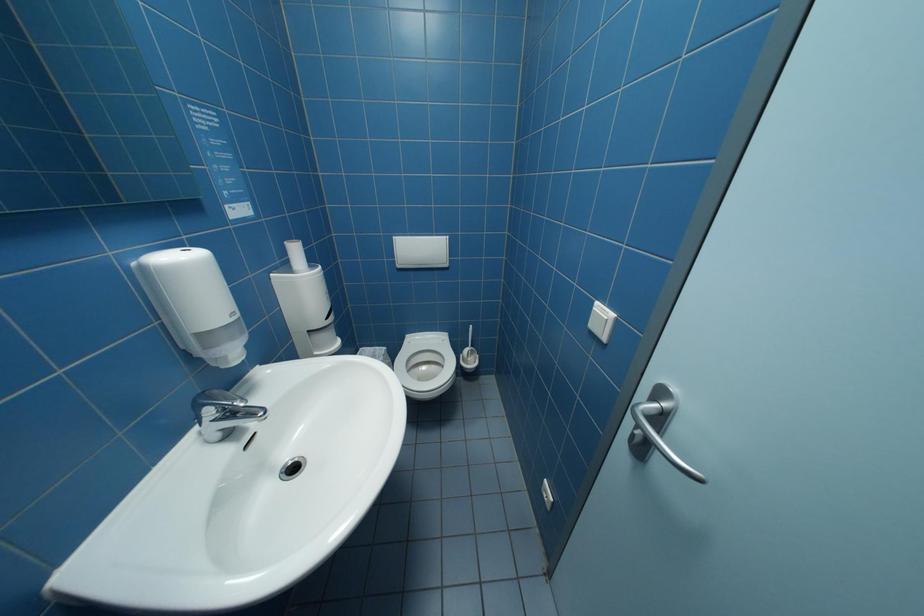
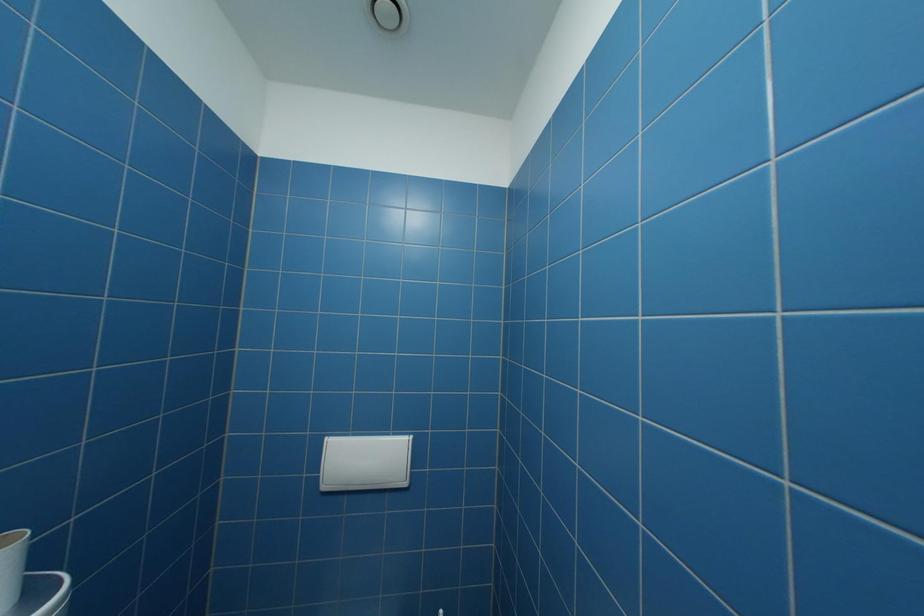
Question: The images are taken continuously from a first-person perspective. In which direction is your viewpoint rotating?

Choices:
 (A) Left
 (B) Right
 (C) Up
 (D) Down

Answer: (C)